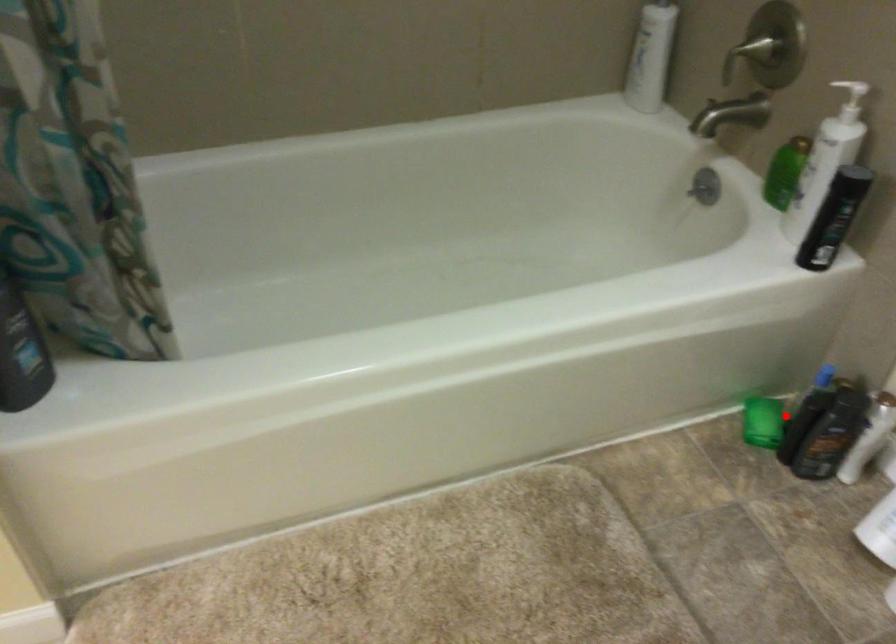
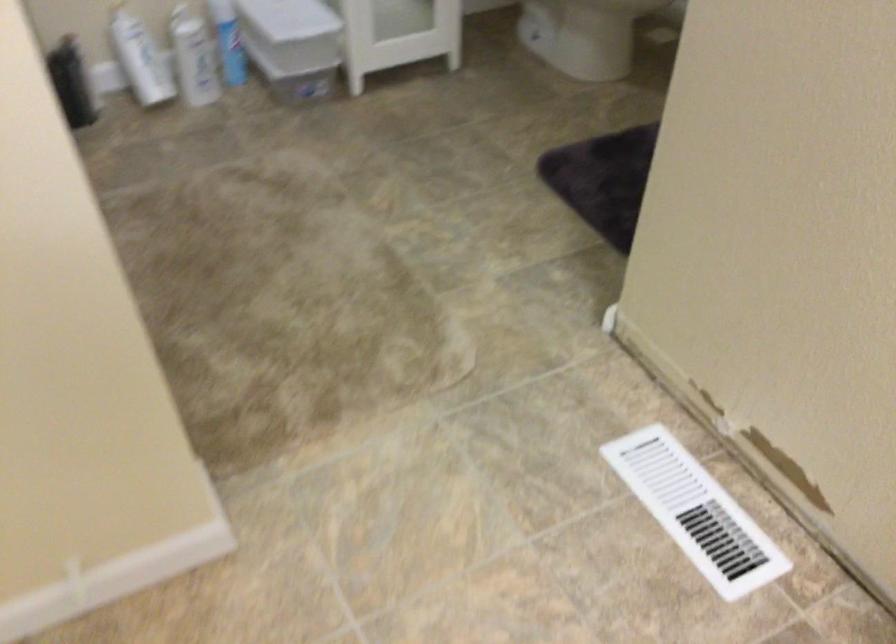
Question: I am providing you with two images of the same scene from different viewpoints. A red point is shown in image1. For the corresponding object point in image2, is it positioned nearer or farther from the camera?

Choices:
 (A) Nearer
 (B) Farther

Answer: (B)